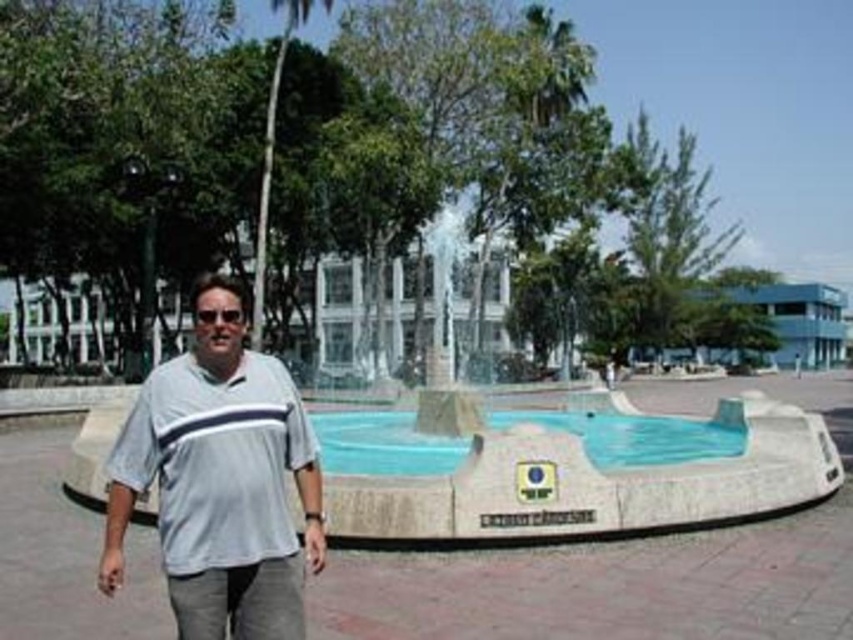
Question: Can you confirm if white stone fountain at center is positioned below clear blue water at center?

Choices:
 (A) yes
 (B) no

Answer: (B)

Question: Which of the following is the closest to the observer?

Choices:
 (A) (218, 480)
 (B) (577, 456)

Answer: (A)

Question: From the image, what is the correct spatial relationship of gray cotton shirt at center in relation to green leafy palm tree at upper center?

Choices:
 (A) above
 (B) below

Answer: (B)

Question: Estimate the real-world distances between objects in this image. Which object is closer to the clear blue water at center?

Choices:
 (A) white stone fountain at center
 (B) green leafy palm tree at upper center
 (C) white concrete pool at center

Answer: (A)

Question: Can you confirm if white stone fountain at center is positioned above green leafy palm tree at upper center?

Choices:
 (A) no
 (B) yes

Answer: (A)

Question: Estimate the real-world distances between objects in this image. Which object is farther from the clear blue water at center?

Choices:
 (A) green leafy palm tree at upper center
 (B) white stone fountain at center
 (C) gray cotton shirt at center

Answer: (A)